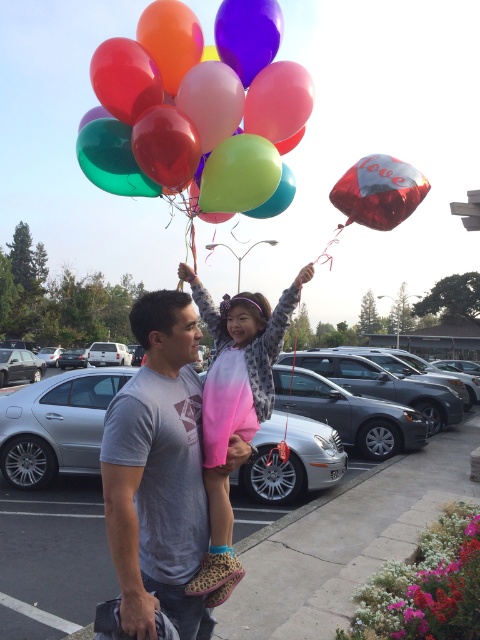
Question: Which of the following is the farthest from the observer?

Choices:
 (A) (247, 108)
 (B) (364, 168)

Answer: (A)

Question: Observing the image, what is the correct spatial positioning of gray cotton t-shirt at center in reference to pink ombre sweater at center?

Choices:
 (A) left
 (B) right

Answer: (A)

Question: In this image, where is glossy latex balloons at upper center located relative to pink ombre sweater at center?

Choices:
 (A) below
 (B) above

Answer: (B)

Question: Among these points, which one is nearest to the camera?

Choices:
 (A) (190, 321)
 (B) (233, 376)
 (C) (60, 512)
 (D) (128, 173)

Answer: (A)

Question: Is glossy latex balloons at upper center bigger than gray cotton t-shirt at center?

Choices:
 (A) yes
 (B) no

Answer: (B)

Question: Which point is closer to the camera?

Choices:
 (A) shiny metallic love balloon at upper center
 (B) gray asphalt parking lot at center

Answer: (B)